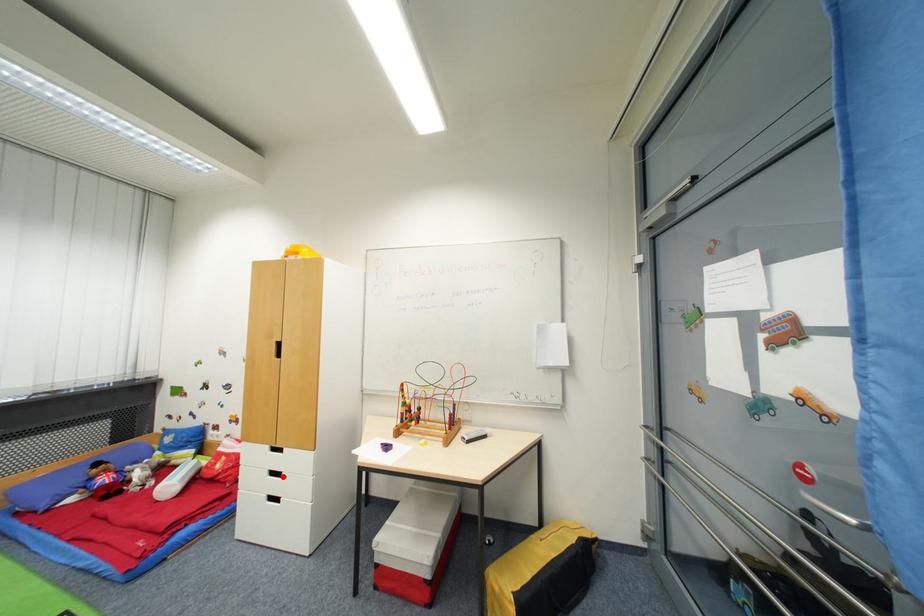
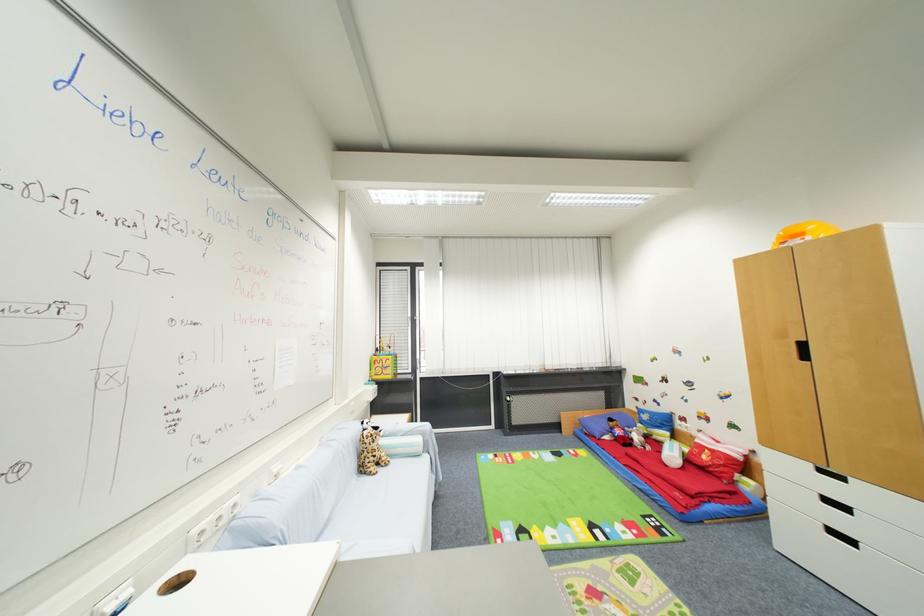
In the second image, find the point that corresponds to the highlighted location in the first image.

(849, 509)